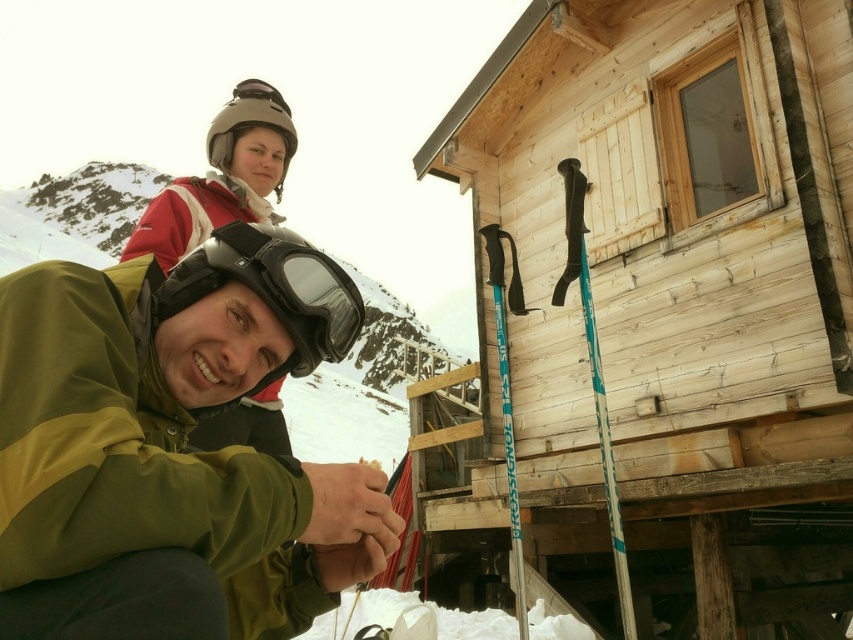
Consider the image. You are standing at the bottom of the mountain and want to take a photo of the weathered wood cabin at center. Where should you position yourself to ensure the cabin is centered in your camera viewfinder?

Position yourself directly in front of the weathered wood cabin at center, as its 2D location at point (662,312) indicates it is centrally located within the frame.

You are a photographer standing at the center of the scene. You want to take a portrait of the green matte jacket at lower left and black matte goggles at center. Can you capture both in a single frame without moving your camera? Explain based on their distance from you.

The green matte jacket at lower left is 26.27 inches away from the black matte goggles at center. Since the distance between them is less than the camera lens field of view, you can capture both in a single frame without moving the camera.